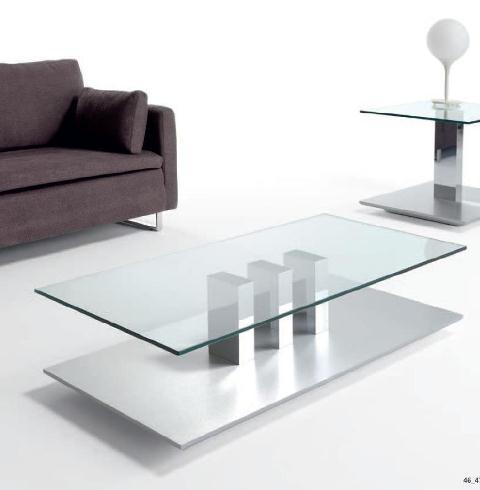
Locate an element on the screen. This screenshot has width=480, height=490. glass table is located at coordinates (233, 314).